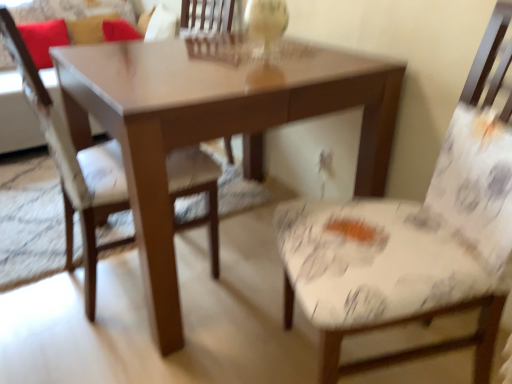
Measure the distance between point (48, 33) and camera.

A distance of 9.14 feet exists between point (48, 33) and camera.

From the picture: Measure the distance between red fabric pillow at upper left, which ranks as the 1th pillow in left-to-right order, and camera.

red fabric pillow at upper left, which ranks as the 1th pillow in left-to-right order, and camera are 7.60 feet apart.

What do you see at coordinates (421, 346) in the screenshot? The height and width of the screenshot is (384, 512). I see `white floral fabric chair at right, which ranks as the 2th chair in left-to-right order` at bounding box center [421, 346].

Identify the location of white floral fabric chair at right, marked as the first chair in a right-to-left arrangement. (421, 346).

Where is `velvet red couch at upper left`? velvet red couch at upper left is located at coordinates (16, 116).

Visually, is velvet red pillow at upper left, which is the second pillow from left to right, positioned to the left or to the right of red fabric pillow at upper left, which is counted as the second pillow, starting from the right?

In the image, velvet red pillow at upper left, which is the second pillow from left to right, appears on the right side of red fabric pillow at upper left, which is counted as the second pillow, starting from the right.

From the image's perspective, relative to red fabric pillow at upper left, which ranks as the 1th pillow in left-to-right order, is velvet red pillow at upper left, the first pillow positioned from the right, above or below?

Clearly, from the image's perspective, velvet red pillow at upper left, the first pillow positioned from the right, is above red fabric pillow at upper left, which ranks as the 1th pillow in left-to-right order.

Is velvet red pillow at upper left, which is the second pillow from left to right, facing towards red fabric pillow at upper left, which is counted as the second pillow, starting from the right?

No, velvet red pillow at upper left, which is the second pillow from left to right, is not oriented towards red fabric pillow at upper left, which is counted as the second pillow, starting from the right.

From a real-world perspective, between white floral fabric chair at right, marked as the first chair in a right-to-left arrangement, and matte brown table at center, who is vertically lower?

matte brown table at center, from a real-world perspective.

In the scene shown: Is white floral fabric chair at right, which ranks as the 2th chair in left-to-right order, beside matte brown table at center?

No, white floral fabric chair at right, which ranks as the 2th chair in left-to-right order, is not with matte brown table at center.

How different are the orientations of white floral fabric chair at right, which ranks as the 2th chair in left-to-right order, and matte brown table at center in degrees?

The angular difference between white floral fabric chair at right, which ranks as the 2th chair in left-to-right order, and matte brown table at center is 25.1 degrees.

Measure the distance between white floral fabric chair at right, which ranks as the 2th chair in left-to-right order, and matte brown table at center.

white floral fabric chair at right, which ranks as the 2th chair in left-to-right order, and matte brown table at center are 30.39 inches apart.

From a real-world perspective, is patterned fabric chair at left, the 2th chair viewed from the right, positioned under white floral fabric chair at right, which ranks as the 2th chair in left-to-right order, based on gravity?

Yes.

Is patterned fabric chair at left, the 2th chair viewed from the right, beside white floral fabric chair at right, which ranks as the 2th chair in left-to-right order?

No, patterned fabric chair at left, the 2th chair viewed from the right, is not touching white floral fabric chair at right, which ranks as the 2th chair in left-to-right order.

Can you confirm if patterned fabric chair at left, marked as the 1th chair in a left-to-right arrangement, is thinner than white floral fabric chair at right, marked as the first chair in a right-to-left arrangement?

Yes, patterned fabric chair at left, marked as the 1th chair in a left-to-right arrangement, is thinner than white floral fabric chair at right, marked as the first chair in a right-to-left arrangement.

Which of these two, velvet red pillow at upper left, the first pillow positioned from the right, or patterned fabric chair at left, the 2th chair viewed from the right, stands shorter?

With less height is velvet red pillow at upper left, the first pillow positioned from the right.

From a real-world perspective, who is located lower, velvet red pillow at upper left, the first pillow positioned from the right, or patterned fabric chair at left, marked as the 1th chair in a left-to-right arrangement?

patterned fabric chair at left, marked as the 1th chair in a left-to-right arrangement, from a real-world perspective.

Is the depth of velvet red pillow at upper left, which is the second pillow from left to right, greater than that of patterned fabric chair at left, the 2th chair viewed from the right?

Yes, it is.

Are velvet red pillow at upper left, which is the second pillow from left to right, and patterned fabric chair at left, marked as the 1th chair in a left-to-right arrangement, located far from each other?

velvet red pillow at upper left, which is the second pillow from left to right, is far away from patterned fabric chair at left, marked as the 1th chair in a left-to-right arrangement.

Considering the sizes of patterned fabric chair at left, marked as the 1th chair in a left-to-right arrangement, and red fabric pillow at upper left, which is counted as the second pillow, starting from the right, in the image, is patterned fabric chair at left, marked as the 1th chair in a left-to-right arrangement, wider or thinner than red fabric pillow at upper left, which is counted as the second pillow, starting from the right,?

patterned fabric chair at left, marked as the 1th chair in a left-to-right arrangement, is wider than red fabric pillow at upper left, which is counted as the second pillow, starting from the right.

From a real-world perspective, which object rests below the other?

In real-world perspective, patterned fabric chair at left, marked as the 1th chair in a left-to-right arrangement, is lower.

Which is in front, point (203, 166) or point (62, 19)?

Point (203, 166)

How far apart are velvet red pillow at upper left, the first pillow positioned from the right, and matte brown table at center?

The distance of velvet red pillow at upper left, the first pillow positioned from the right, from matte brown table at center is 6.63 feet.

In the scene shown: Does velvet red pillow at upper left, which is the second pillow from left to right, have a lesser width compared to matte brown table at center?

Indeed, velvet red pillow at upper left, which is the second pillow from left to right, has a lesser width compared to matte brown table at center.

From the image's perspective, is velvet red pillow at upper left, which is the second pillow from left to right, on matte brown table at center?

Yes, from the image's perspective, velvet red pillow at upper left, which is the second pillow from left to right, is over matte brown table at center.

Is velvet red pillow at upper left, which is the second pillow from left to right, in front of or behind matte brown table at center in the image?

velvet red pillow at upper left, which is the second pillow from left to right, is behind matte brown table at center.

What's the angular difference between velvet red couch at upper left and red fabric pillow at upper left, which is counted as the second pillow, starting from the right,'s facing directions?

They differ by 0.000121 degrees in their facing directions.

Which point is more distant from viewer, (x=0, y=74) or (x=65, y=33)?

The point (x=65, y=33) is farther.

Between velvet red couch at upper left and red fabric pillow at upper left, which is counted as the second pillow, starting from the right, which one has smaller size?

red fabric pillow at upper left, which is counted as the second pillow, starting from the right, is smaller.

Could you tell me if velvet red couch at upper left is facing red fabric pillow at upper left, which ranks as the 1th pillow in left-to-right order?

No, velvet red couch at upper left is not turned towards red fabric pillow at upper left, which ranks as the 1th pillow in left-to-right order.

Find the location of a particular element. The height and width of the screenshot is (384, 512). pillow that is above the red fabric pillow at upper left, which ranks as the 1th pillow in left-to-right order (from the image's perspective) is located at coordinates (88, 28).

This screenshot has width=512, height=384. In order to click on chair in front of the matte brown table at center in this screenshot , I will do `click(421, 346)`.

In the scene shown: Based on their spatial positions, is velvet red pillow at upper left, which is the second pillow from left to right, or patterned fabric chair at left, marked as the 1th chair in a left-to-right arrangement, closer to matte brown table at center?

The object closer to matte brown table at center is patterned fabric chair at left, marked as the 1th chair in a left-to-right arrangement.

Looking at the image, which one is located further to velvet red pillow at upper left, the first pillow positioned from the right, patterned fabric chair at left, marked as the 1th chair in a left-to-right arrangement, or red fabric pillow at upper left, which is counted as the second pillow, starting from the right?

Based on the image, patterned fabric chair at left, marked as the 1th chair in a left-to-right arrangement, appears to be further to velvet red pillow at upper left, the first pillow positioned from the right.

From the picture: Which object lies further to the anchor point velvet red couch at upper left, matte brown table at center or velvet red pillow at upper left, which is the second pillow from left to right?

matte brown table at center.

When comparing their distances from velvet red couch at upper left, does red fabric pillow at upper left, which is counted as the second pillow, starting from the right, or patterned fabric chair at left, marked as the 1th chair in a left-to-right arrangement, seem further?

patterned fabric chair at left, marked as the 1th chair in a left-to-right arrangement.

Estimate the real-world distances between objects in this image. Which object is closer to patterned fabric chair at left, the 2th chair viewed from the right, red fabric pillow at upper left, which is counted as the second pillow, starting from the right, or white floral fabric chair at right, which ranks as the 2th chair in left-to-right order?

white floral fabric chair at right, which ranks as the 2th chair in left-to-right order, is positioned closer to the anchor patterned fabric chair at left, the 2th chair viewed from the right.

When comparing their distances from white floral fabric chair at right, which ranks as the 2th chair in left-to-right order, does red fabric pillow at upper left, which ranks as the 1th pillow in left-to-right order, or velvet red couch at upper left seem further?

The object further to white floral fabric chair at right, which ranks as the 2th chair in left-to-right order, is red fabric pillow at upper left, which ranks as the 1th pillow in left-to-right order.

Looking at the image, which one is located closer to white floral fabric chair at right, which ranks as the 2th chair in left-to-right order, patterned fabric chair at left, the 2th chair viewed from the right, or red fabric pillow at upper left, which ranks as the 1th pillow in left-to-right order?

patterned fabric chair at left, the 2th chair viewed from the right, lies closer to white floral fabric chair at right, which ranks as the 2th chair in left-to-right order, than the other object.

Based on their spatial positions, is velvet red couch at upper left or velvet red pillow at upper left, which is the second pillow from left to right, closer to matte brown table at center?

velvet red couch at upper left is closer to matte brown table at center.

Locate an element on the screen. couch between patterned fabric chair at left, the 2th chair viewed from the right, and red fabric pillow at upper left, which ranks as the 1th pillow in left-to-right order, along the z-axis is located at coordinates (16, 116).

Image resolution: width=512 pixels, height=384 pixels. I want to click on coffee table between white floral fabric chair at right, marked as the first chair in a right-to-left arrangement, and velvet red pillow at upper left, which is the second pillow from left to right, in the front-back direction, so (214, 123).

Locate an element on the screen. coffee table between white floral fabric chair at right, marked as the first chair in a right-to-left arrangement, and red fabric pillow at upper left, which is counted as the second pillow, starting from the right, along the z-axis is located at coordinates (214, 123).

This screenshot has width=512, height=384. I want to click on chair between white floral fabric chair at right, marked as the first chair in a right-to-left arrangement, and red fabric pillow at upper left, which ranks as the 1th pillow in left-to-right order, in the front-back direction, so click(x=74, y=167).